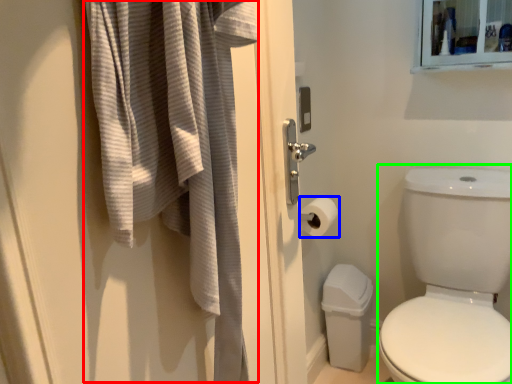
Question: Which object is the closest to the bath towel (highlighted by a red box)? Choose among these: toilet paper (highlighted by a blue box) or toilet bowl (highlighted by a green box).

Choices:
 (A) toilet paper
 (B) toilet bowl

Answer: (A)